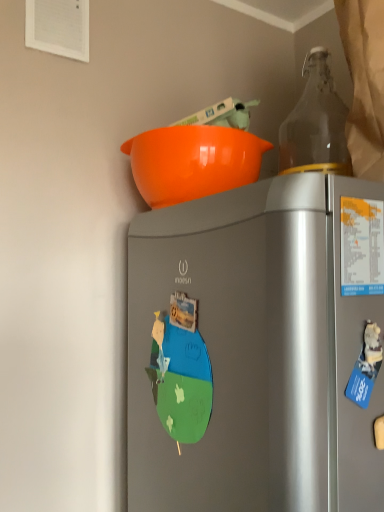
The image size is (384, 512). What do you see at coordinates (258, 349) in the screenshot?
I see `matte gray refrigerator at center` at bounding box center [258, 349].

Locate an element on the screen. The width and height of the screenshot is (384, 512). matte gray refrigerator at center is located at coordinates (258, 349).

Find the location of a particular element. This screenshot has width=384, height=512. matte gray refrigerator at center is located at coordinates (258, 349).